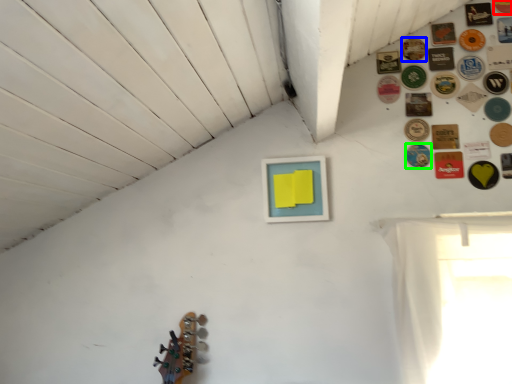
Question: Which is nearer to the button (highlighted by a red box)? button (highlighted by a blue box) or button (highlighted by a green box).

Choices:
 (A) button
 (B) button

Answer: (A)